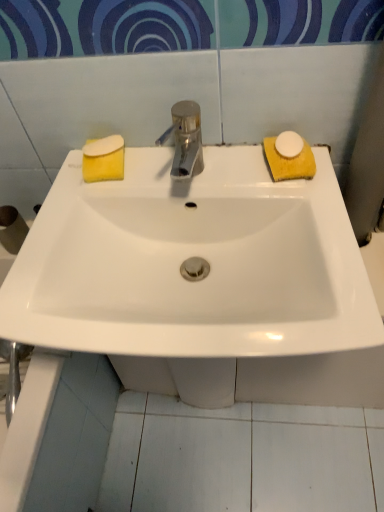
At what (x,y) coordinates should I click in order to perform the action: click on vacant point to the left of yellow sponge at left, the 3th soap in the right-to-left sequence. Please return your answer as a coordinate pair (x, y). Looking at the image, I should click on (66, 177).